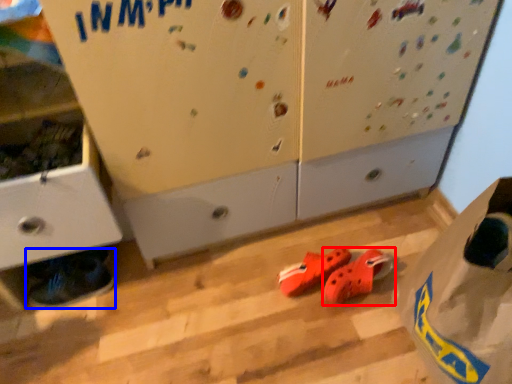
Question: Among these objects, which one is farthest to the camera, footwear (highlighted by a red box) or footwear (highlighted by a blue box)?

Choices:
 (A) footwear
 (B) footwear

Answer: (B)